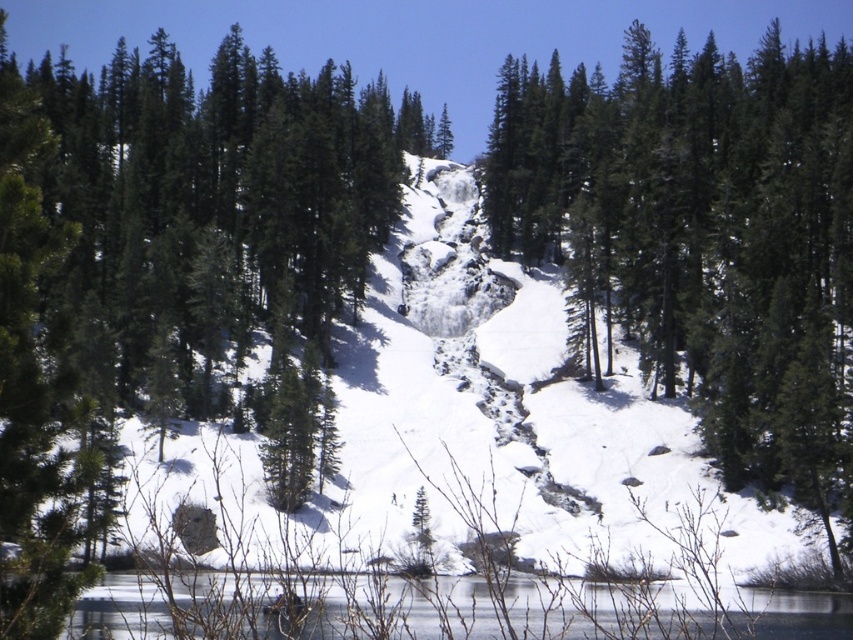
You are standing at the bottom of the snow slope and want to reach the green matte tree at center. Which direction should you head to reach it?

The green matte tree at center is located at point 0.373 on the x axis and 0.824 on the y axis, so you should head towards the center of the slope to reach it.

You are an outdoor photographer planning to capture the reflection of the green matte tree at center in the clear ice lake at lower center. Can you expect to see the tree reflected in the lake?

The green matte tree at center is above the clear ice lake at lower center, so its reflection should be visible in the lake since reflections occur when light bounces off a smooth surface like water. However, the presence of ice might slightly distort or reduce the clarity of the reflection.